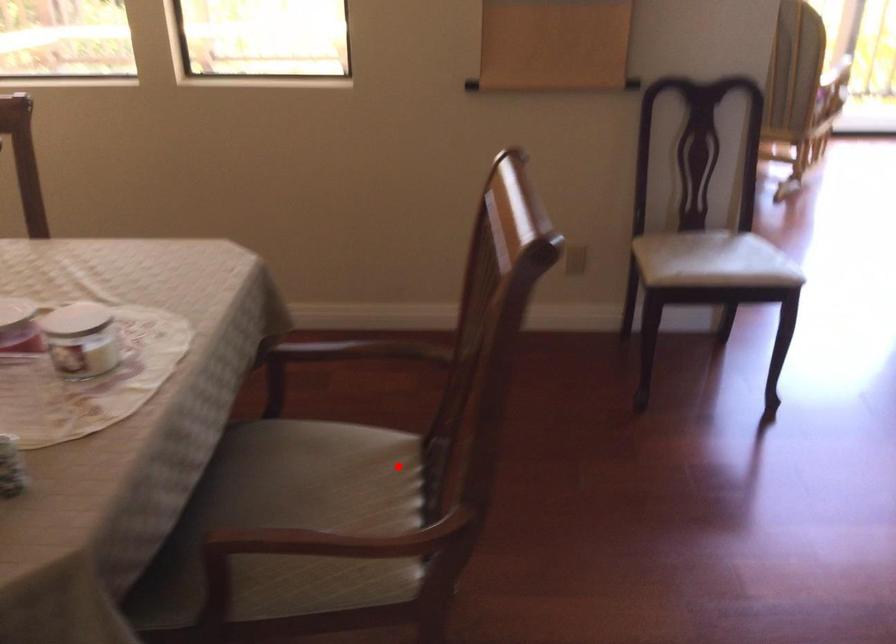
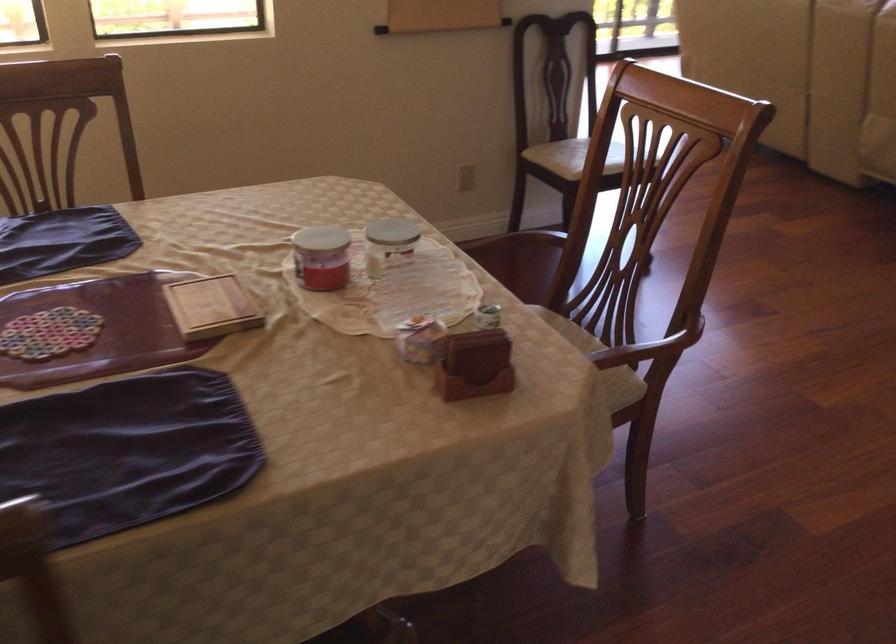
Question: I am providing you with two images of the same scene from different viewpoints. A red point is shown in image1. For the corresponding object point in image2, is it positioned nearer or farther from the camera?

Choices:
 (A) Nearer
 (B) Farther

Answer: (B)